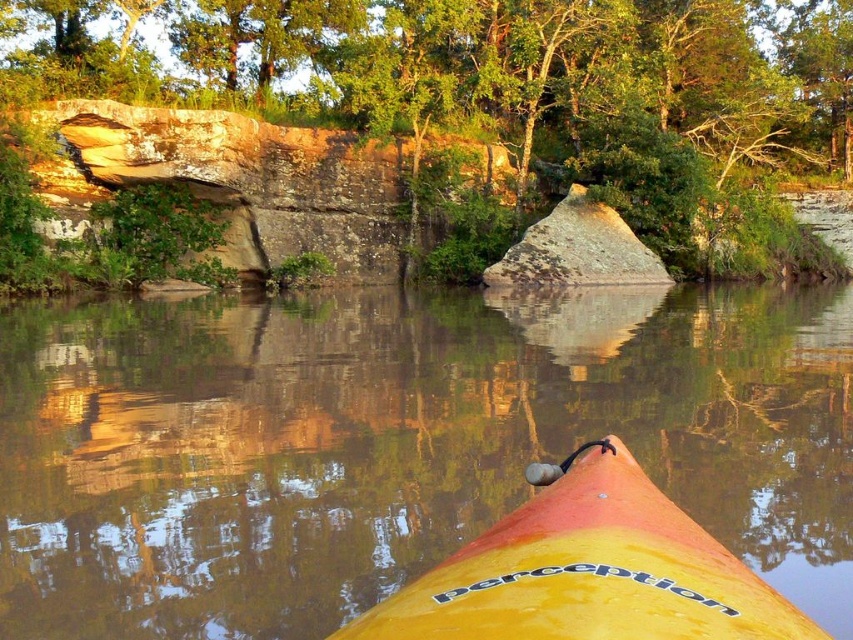
In order to click on green leafy tree at upper center in this screenshot , I will do [508, 88].

Locate an element on the screen. green leafy tree at upper center is located at coordinates (508, 88).

Does brown reflective water at center come behind green leafy tree at upper center?

That is False.

Which is more to the right, brown reflective water at center or green leafy tree at upper center?

green leafy tree at upper center is more to the right.

Which is in front, point (367, 333) or point (199, 58)?

Point (367, 333) is more forward.

The height and width of the screenshot is (640, 853). Find the location of `brown reflective water at center`. brown reflective water at center is located at coordinates (395, 444).

Looking at this image, how far apart are brown reflective water at center and rusty metallic rock at center?

The distance of brown reflective water at center from rusty metallic rock at center is 17.11 meters.

Which is more to the right, brown reflective water at center or rusty metallic rock at center?

rusty metallic rock at center

Is point (277, 531) positioned behind point (599, 221)?

No.

The image size is (853, 640). In order to click on brown reflective water at center in this screenshot , I will do `click(395, 444)`.